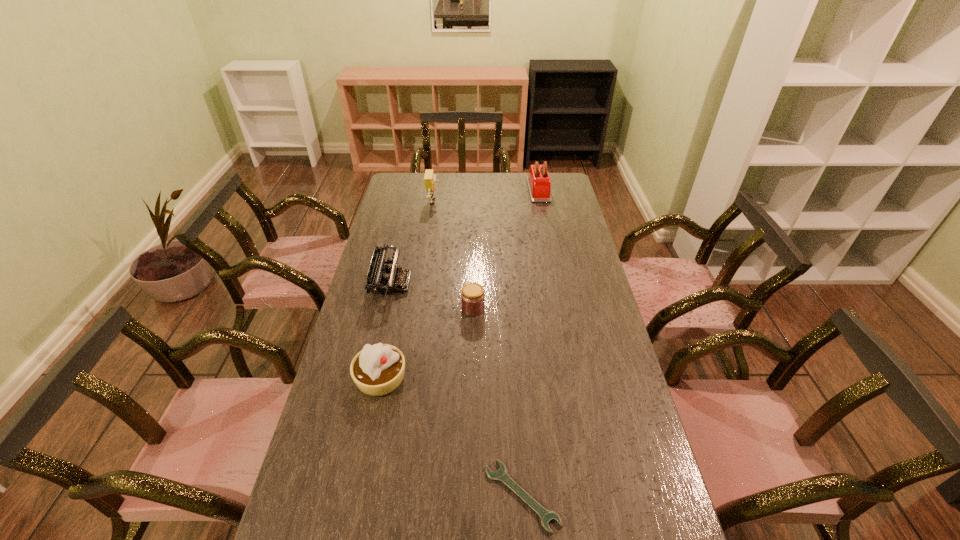
You are a GUI agent. You are given a task and a screenshot of the screen. Output one action in this format:
    pyautogui.click(x=<x>, y=<y>)
    Task: Click on the vacant area that lies between the nearest object and the toaster
    This screenshot has height=540, width=960.
    Given the screenshot: What is the action you would take?
    pyautogui.click(x=530, y=342)

Locate an element on the screen. object that is the closest to the typewriter is located at coordinates (378, 369).

The height and width of the screenshot is (540, 960). Find the location of `object that is the closest to the toaster`. object that is the closest to the toaster is located at coordinates (430, 178).

I want to click on vacant space that satisfies the following two spatial constraints: 1. on the back side of the toaster; 2. on the right side of the nearest object, so click(500, 190).

Find the location of a particular element. free space that satisfies the following two spatial constraints: 1. on the typing side of the typewriter; 2. on the left side of the nearest object is located at coordinates (344, 495).

Where is `vacant space that satisfies the following two spatial constraints: 1. on the face of the sponge; 2. on the left side of the jam`? The image size is (960, 540). vacant space that satisfies the following two spatial constraints: 1. on the face of the sponge; 2. on the left side of the jam is located at coordinates (418, 308).

At what (x,y) coordinates should I click in order to perform the action: click on vacant space that satisfies the following two spatial constraints: 1. on the typing side of the typewriter; 2. on the right side of the fifth tallest object. Please return your answer as a coordinate pair (x, y). Looking at the image, I should click on (386, 308).

Identify the location of vacant position in the image that satisfies the following two spatial constraints: 1. on the typing side of the typewriter; 2. on the right side of the whipped cream. (370, 378).

Identify the location of vacant space that satisfies the following two spatial constraints: 1. on the front side of the rightmost object; 2. on the typing side of the typewriter. (557, 284).

Image resolution: width=960 pixels, height=540 pixels. I want to click on free location that satisfies the following two spatial constraints: 1. on the back side of the rightmost object; 2. on the left side of the second nearest object, so click(x=420, y=190).